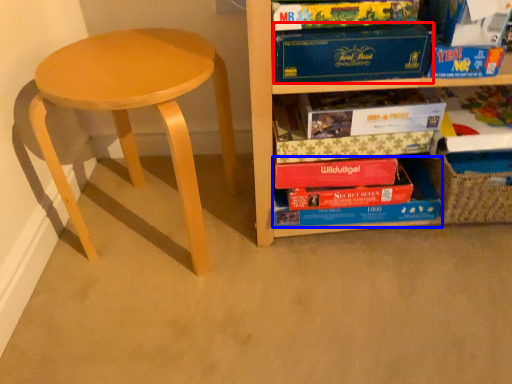
Question: Which object is closer to the camera taking this photo, paperback book (highlighted by a red box) or book (highlighted by a blue box)?

Choices:
 (A) paperback book
 (B) book

Answer: (A)